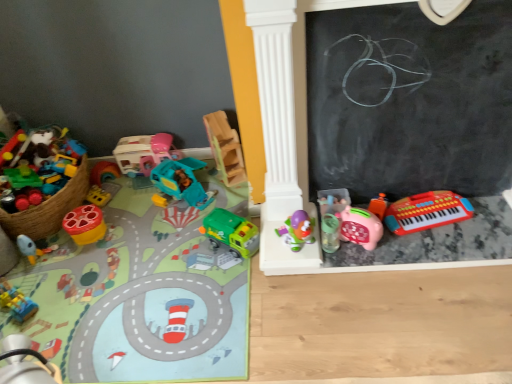
Identify the location of vacant area that lies between wooden blocks at center, the sixth toy in the right-to-left sequence, and plastic yellow car at lower left, arranged as the eleventh toy when viewed from the right. Image resolution: width=512 pixels, height=384 pixels. (126, 242).